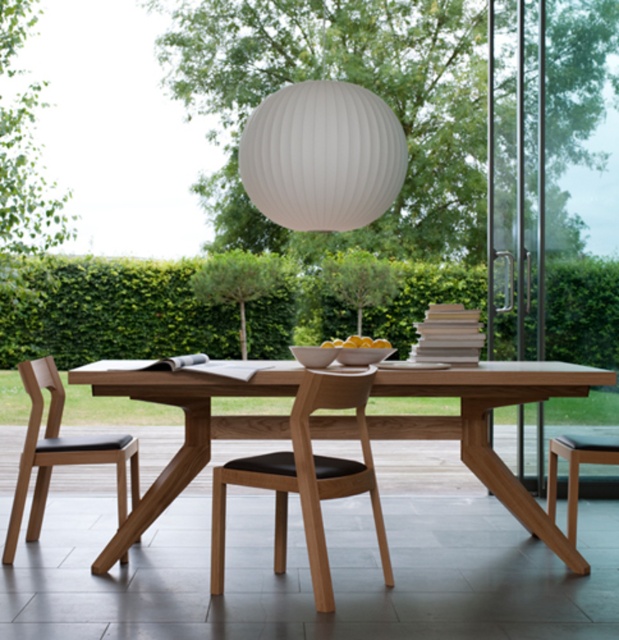
Question: Which object is closer to the camera taking this photo?

Choices:
 (A) natural wood chair at left
 (B) light brown wood stool at lower right
 (C) light brown wood chair at center

Answer: (C)

Question: Does light brown wood chair at center appear on the left side of transparent glass door at right?

Choices:
 (A) no
 (B) yes

Answer: (B)

Question: Does light brown wood chair at center appear under yellow matte bowl at center?

Choices:
 (A) yes
 (B) no

Answer: (A)

Question: Which object is positioned closest to the light brown wood chair at center?

Choices:
 (A) natural wood chair at left
 (B) white ribbed paper lantern at upper center
 (C) yellow matte bowl at center

Answer: (A)

Question: Estimate the real-world distances between objects in this image. Which object is closer to the natural wood table at center?

Choices:
 (A) light brown wood stool at lower right
 (B) white ribbed paper lantern at upper center
 (C) yellow matte bowl at center
 (D) light brown wood chair at center

Answer: (D)

Question: Can you confirm if white ribbed paper lantern at upper center is smaller than light brown wood stool at lower right?

Choices:
 (A) no
 (B) yes

Answer: (A)